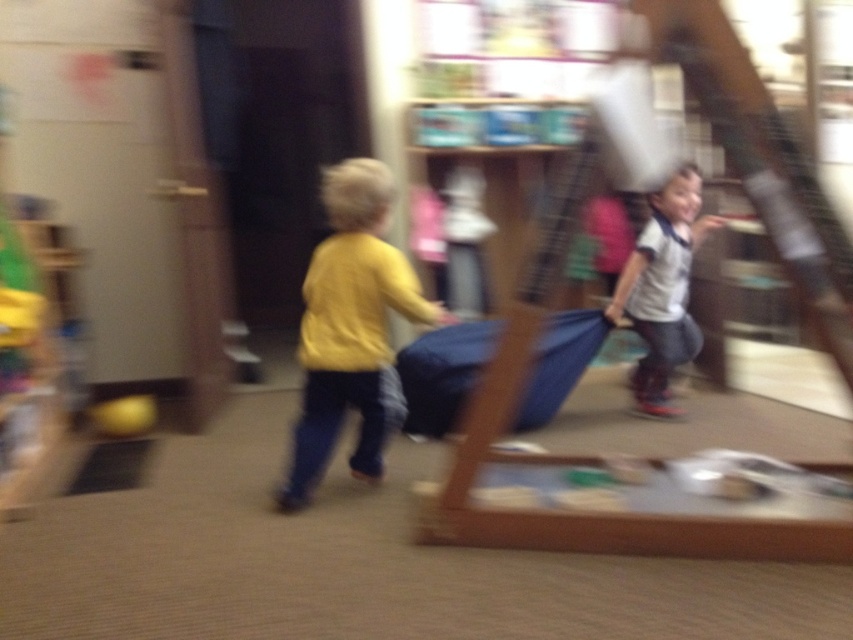
Question: Is the position of yellow matte shirt at left less distant than that of white matte shirt at right?

Choices:
 (A) yes
 (B) no

Answer: (A)

Question: Does yellow matte shirt at left appear under white matte shirt at right?

Choices:
 (A) yes
 (B) no

Answer: (A)

Question: Which object appears closest to the camera in this image?

Choices:
 (A) yellow matte shirt at left
 (B) white matte shirt at right

Answer: (A)

Question: Can you confirm if yellow matte shirt at left is bigger than white matte shirt at right?

Choices:
 (A) yes
 (B) no

Answer: (B)